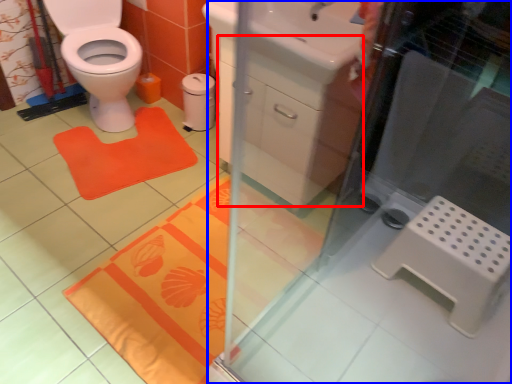
Question: Which object is closer to the camera taking this photo, drawer (highlighted by a red box) or screen door (highlighted by a blue box)?

Choices:
 (A) drawer
 (B) screen door

Answer: (B)